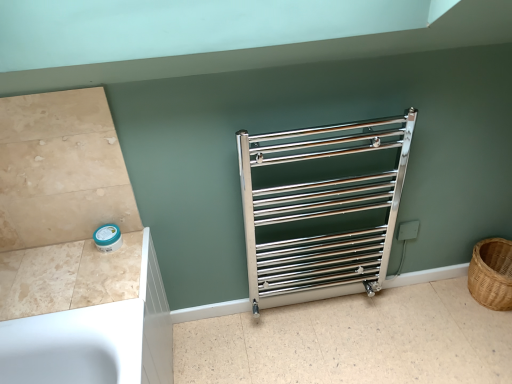
You are a GUI agent. You are given a task and a screenshot of the screen. Output one action in this format:
    pyautogui.click(x=<x>, y=<y>)
    Task: Click on the vacant area to the right of polished chrome towel rack at center
    
    Given the screenshot: What is the action you would take?
    pyautogui.click(x=413, y=326)